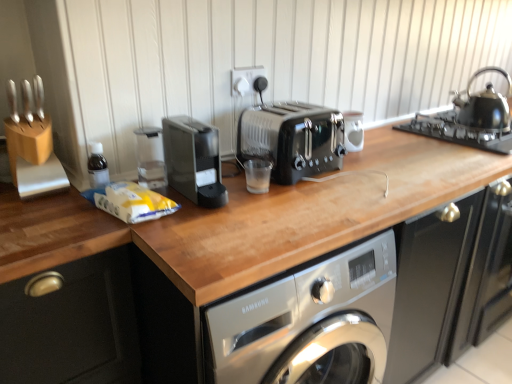
Question: Could you tell me if matte black knob at upper center is facing wooden knife block at upper left?

Choices:
 (A) yes
 (B) no

Answer: (B)

Question: Considering the relative sizes of matte black knob at upper center and wooden knife block at upper left in the image provided, is matte black knob at upper center thinner than wooden knife block at upper left?

Choices:
 (A) no
 (B) yes

Answer: (B)

Question: Does matte black knob at upper center have a smaller size compared to wooden knife block at upper left?

Choices:
 (A) no
 (B) yes

Answer: (B)

Question: From a real-world perspective, is matte black knob at upper center located higher than wooden knife block at upper left?

Choices:
 (A) no
 (B) yes

Answer: (A)

Question: Considering the relative sizes of matte black knob at upper center and wooden knife block at upper left in the image provided, is matte black knob at upper center taller than wooden knife block at upper left?

Choices:
 (A) no
 (B) yes

Answer: (A)

Question: Considering the relative sizes of matte black knob at upper center and wooden knife block at upper left in the image provided, is matte black knob at upper center wider than wooden knife block at upper left?

Choices:
 (A) yes
 (B) no

Answer: (B)

Question: Does white glossy coffee cup at center come in front of matte black knob at upper center?

Choices:
 (A) yes
 (B) no

Answer: (B)

Question: Can you confirm if white glossy coffee cup at center is positioned to the left of matte black knob at upper center?

Choices:
 (A) yes
 (B) no

Answer: (B)

Question: Does white glossy coffee cup at center have a smaller size compared to matte black knob at upper center?

Choices:
 (A) yes
 (B) no

Answer: (B)

Question: Could you tell me if white glossy coffee cup at center is facing matte black knob at upper center?

Choices:
 (A) no
 (B) yes

Answer: (A)

Question: From the image's perspective, would you say white glossy coffee cup at center is positioned over matte black knob at upper center?

Choices:
 (A) yes
 (B) no

Answer: (B)

Question: Does white glossy coffee cup at center appear on the right side of matte black knob at upper center?

Choices:
 (A) yes
 (B) no

Answer: (A)

Question: Is black metallic toaster at center placed right next to white plastic socket at upper center?

Choices:
 (A) no
 (B) yes

Answer: (A)